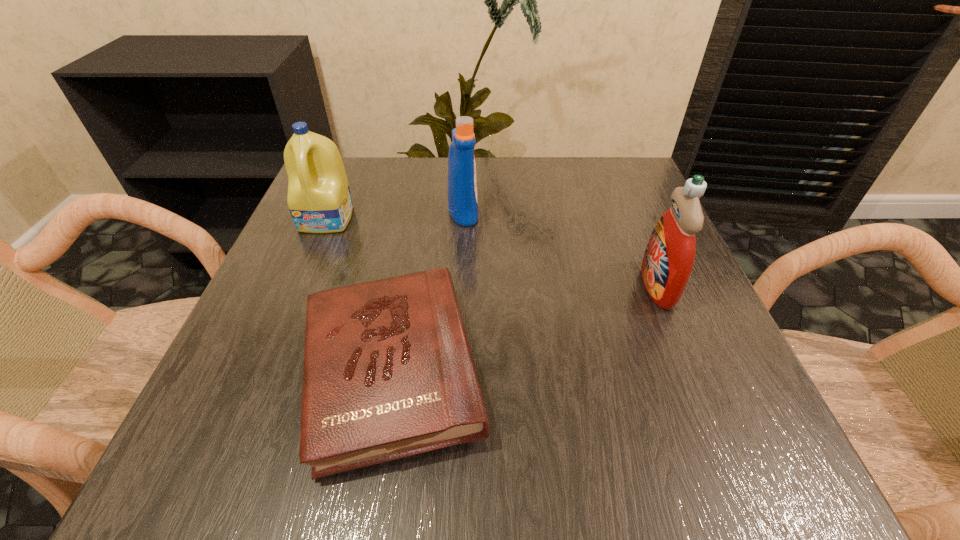
In the image, there is a desktop. Where is `vacant space at the right edge`? The width and height of the screenshot is (960, 540). vacant space at the right edge is located at coordinates (618, 321).

The width and height of the screenshot is (960, 540). What are the coordinates of `vacant space at the far left corner of the desktop` in the screenshot? It's located at (362, 184).

In the image, there is a desktop. At what (x,y) coordinates should I click in order to perform the action: click on vacant region at the far right corner. Please return your answer as a coordinate pair (x, y). Image resolution: width=960 pixels, height=540 pixels. Looking at the image, I should click on pyautogui.click(x=580, y=168).

This screenshot has width=960, height=540. In order to click on empty space between the second detergent from left to right and the leftmost detergent in this screenshot , I will do `click(396, 215)`.

Identify the location of empty location between the second detergent from right to left and the leftmost detergent. This screenshot has width=960, height=540. (396, 215).

Image resolution: width=960 pixels, height=540 pixels. I want to click on empty space between the leftmost detergent and the second detergent from right to left, so click(x=396, y=215).

Where is `free space that is in between the rightmost object and the shortest object`? The image size is (960, 540). free space that is in between the rightmost object and the shortest object is located at coordinates (524, 328).

Locate an element on the screen. The height and width of the screenshot is (540, 960). free space between the second detergent from right to left and the rightmost detergent is located at coordinates (561, 249).

Where is `vacant space that's between the nearest detergent and the shortest object`? The image size is (960, 540). vacant space that's between the nearest detergent and the shortest object is located at coordinates (524, 328).

Identify the location of the third closest object to the rightmost detergent. This screenshot has height=540, width=960. (319, 200).